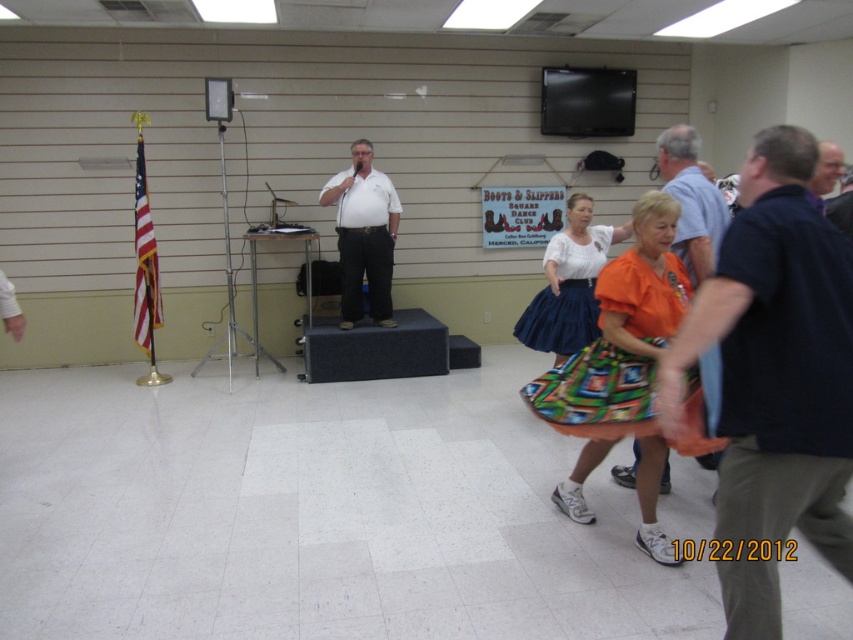
Question: Does orange printed skirt at right have a larger size compared to orange fabric dress at right?

Choices:
 (A) no
 (B) yes

Answer: (B)

Question: Is black cotton shirt at right thinner than velvet blue skirt at center?

Choices:
 (A) no
 (B) yes

Answer: (B)

Question: Does orange fabric dress at right have a greater width compared to smooth brown hair at upper right?

Choices:
 (A) yes
 (B) no

Answer: (B)

Question: Among these objects, which one is nearest to the camera?

Choices:
 (A) smooth brown hair at upper right
 (B) orange fabric dress at right

Answer: (B)

Question: Which point is farther to the camera?

Choices:
 (A) orange printed skirt at right
 (B) black cotton shirt at right
 (C) white matte shirt at center

Answer: (C)

Question: Which is nearer to the black cotton shirt at right?

Choices:
 (A) smooth brown hair at upper right
 (B) orange printed skirt at right
 (C) orange fabric dress at right

Answer: (B)